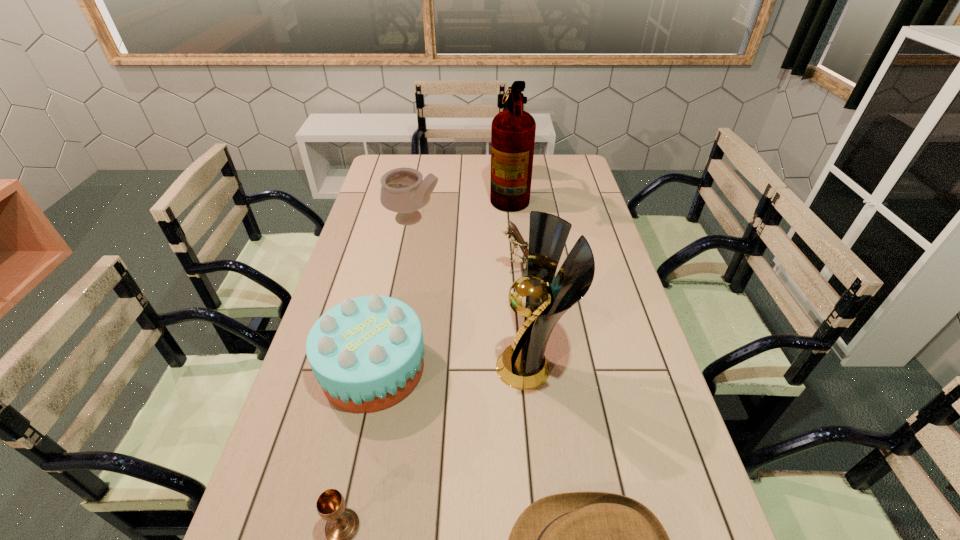
Where is `fire extinguisher`? This screenshot has width=960, height=540. fire extinguisher is located at coordinates (513, 130).

The height and width of the screenshot is (540, 960). Find the location of `the sixth shortest object`. the sixth shortest object is located at coordinates (522, 365).

Locate an element on the screen. pottery is located at coordinates (403, 191).

Locate an element on the screen. This screenshot has width=960, height=540. figurine is located at coordinates (514, 235).

Identify the location of the third shortest object. The width and height of the screenshot is (960, 540). (367, 353).

This screenshot has width=960, height=540. Find the location of `free location located at the nozzle of the tallest object`. free location located at the nozzle of the tallest object is located at coordinates (466, 194).

Locate an element on the screen. vacant area located 0.220m at the nozzle of the tallest object is located at coordinates (437, 194).

The image size is (960, 540). Find the location of `vacant region located 0.150m at the nozzle of the tallest object`. vacant region located 0.150m at the nozzle of the tallest object is located at coordinates (453, 194).

Locate an element on the screen. The height and width of the screenshot is (540, 960). blank space located at the front of the award, where the globe is visible is located at coordinates (398, 367).

This screenshot has width=960, height=540. I want to click on vacant space located 0.220m at the front of the award, where the globe is visible, so click(x=413, y=367).